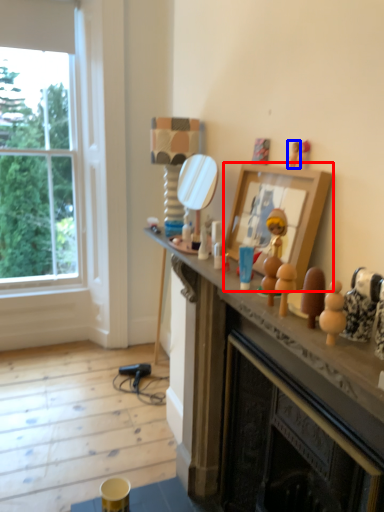
Question: Which of the following is the closest to the observer, picture frame (highlighted by a red box) or toy (highlighted by a blue box)?

Choices:
 (A) picture frame
 (B) toy

Answer: (A)